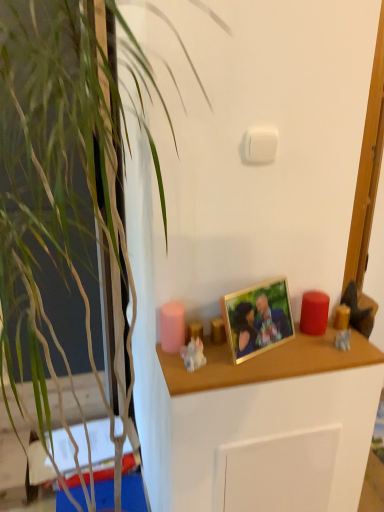
Locate an element on the screen. spots to the right of porcelain figurine at center, which is the second toy from right to left is located at coordinates (258, 359).